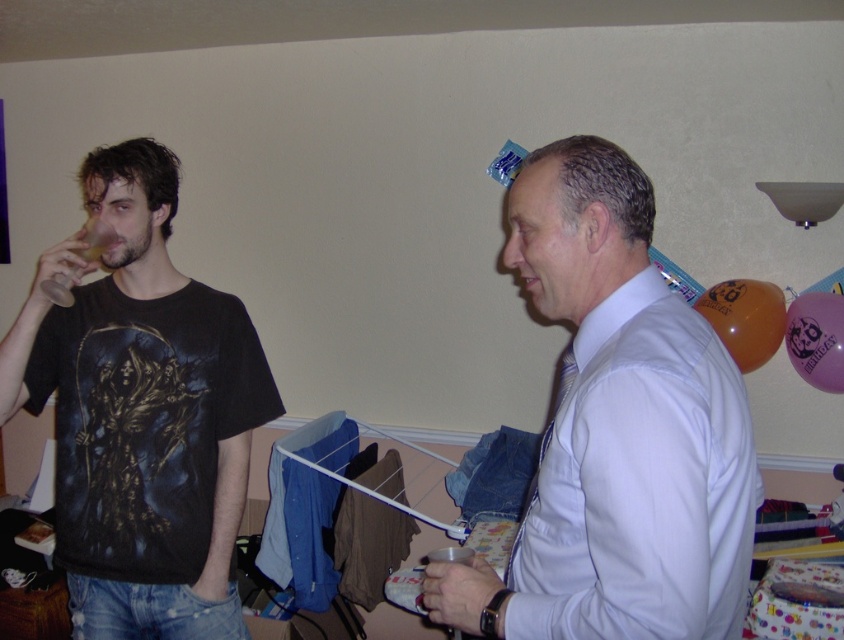
You are planning to hang a picture frame that is 3 feet wide between the white glossy shirt at center and the translucent orange balloon at upper right. Will there be enough space to fit the frame without overlapping either object?

The distance between the white glossy shirt at center and the translucent orange balloon at upper right is 4.60 feet. Since the picture frame is 3 feet wide, there is sufficient space as 3 feet is less than 4.60 feet. The frame can be placed between them without overlapping.

You are standing in the room and want to grab the pink latex balloon at upper right without moving from your current position. Is the white glossy shirt at center closer to you than the balloon?

The white glossy shirt at center is 4.83 feet away from the pink latex balloon at upper right. Since you are at your current position, the distance between you and each object isn